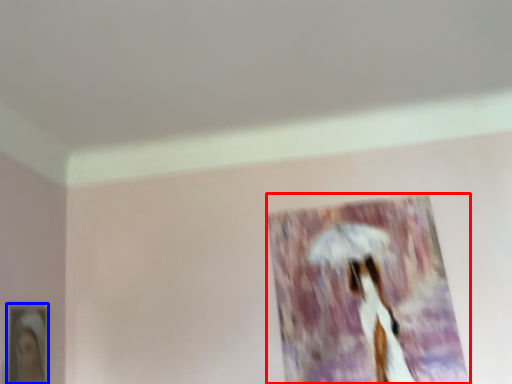
Question: Among these objects, which one is farthest to the camera, picture frame (highlighted by a red box) or picture frame (highlighted by a blue box)?

Choices:
 (A) picture frame
 (B) picture frame

Answer: (A)